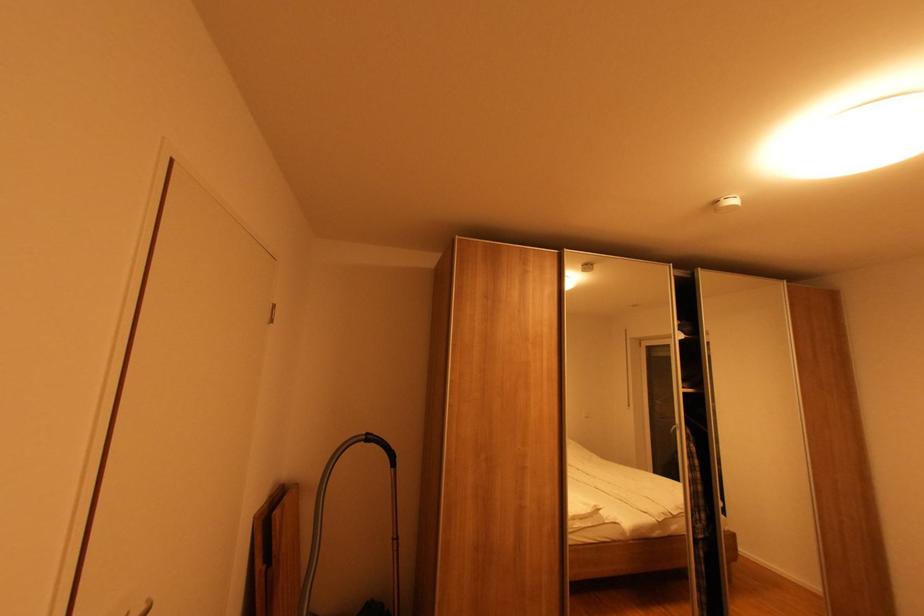
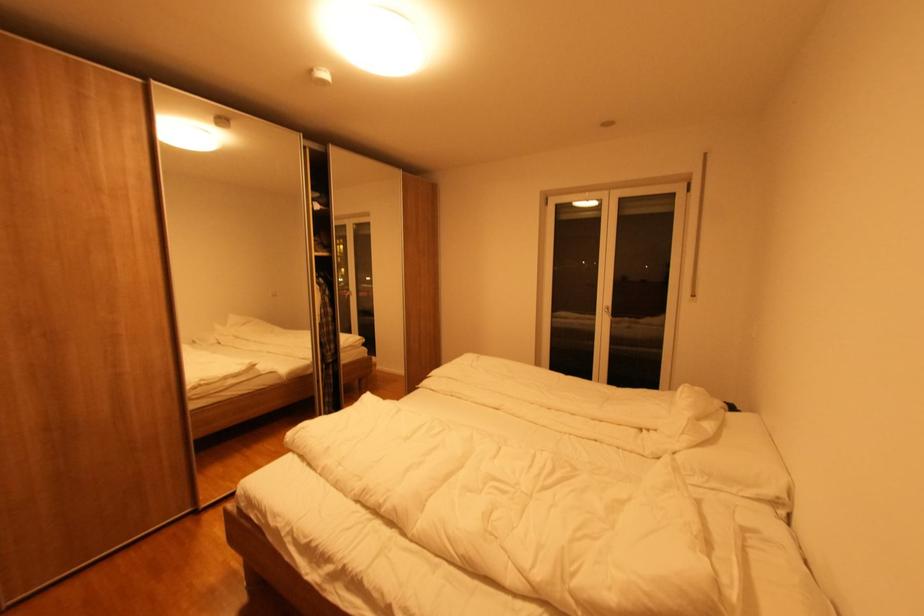
First-person continuous shooting, in which direction is the camera rotating?

The rotation direction of the camera is right-down.